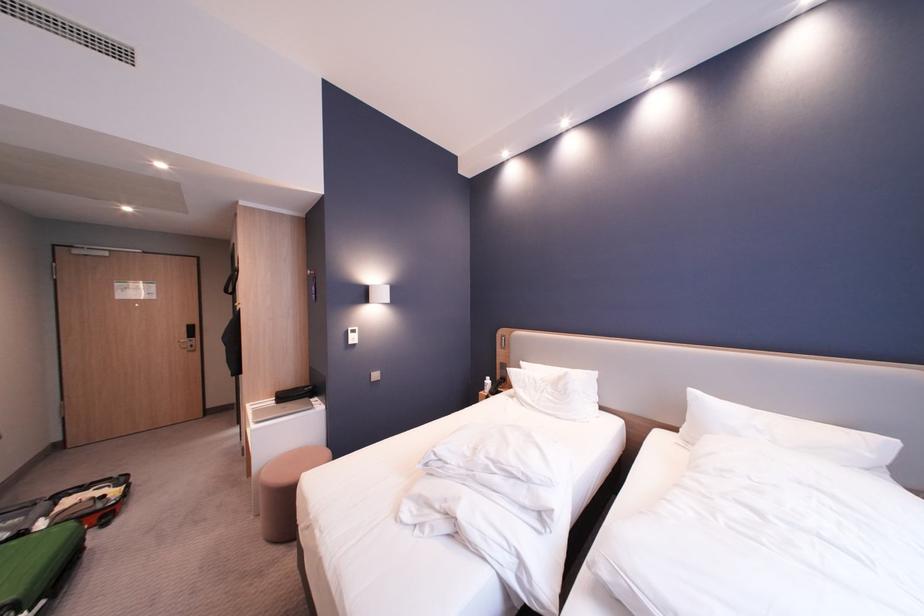
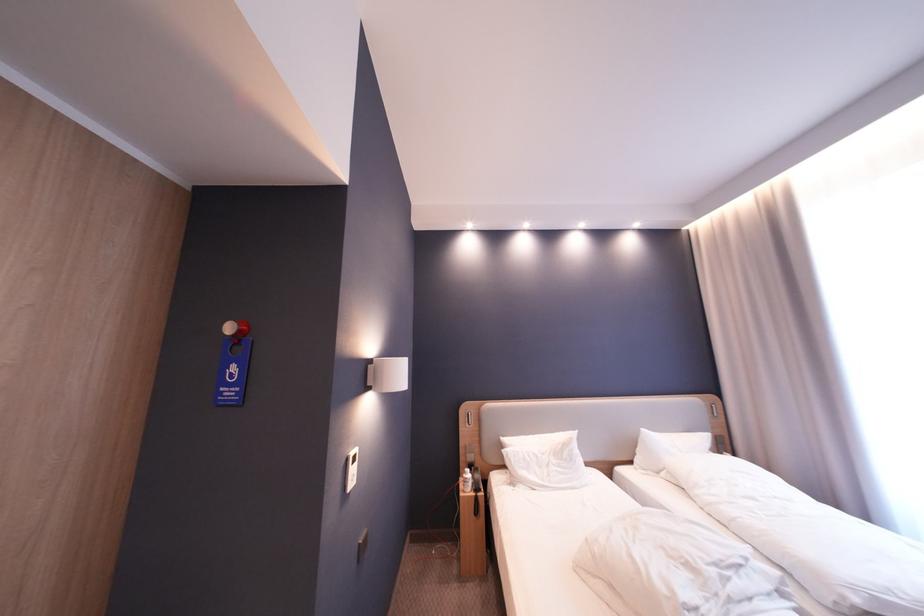
Where in the second image is the point corresponding to (x=324, y=289) from the first image?

(245, 370)